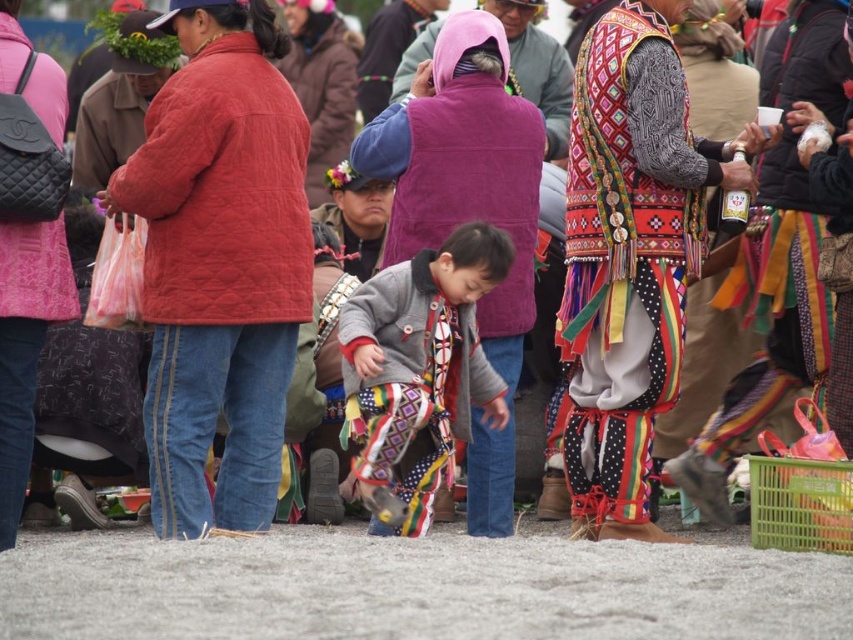
Question: Can you confirm if purple fleece vest at center is smaller than patterned fabric pants at center?

Choices:
 (A) yes
 (B) no

Answer: (B)

Question: Does quilted red jacket at center appear over purple fleece vest at center?

Choices:
 (A) no
 (B) yes

Answer: (A)

Question: Considering the real-world distances, which object is farthest from the purple fleece vest at center?

Choices:
 (A) patterned fabric pants at center
 (B) quilted red jacket at center
 (C) embroidered fabric dress at center

Answer: (A)

Question: Which point is closer to the camera?

Choices:
 (A) (422, 275)
 (B) (595, 138)

Answer: (A)

Question: Is quilted red jacket at center above purple fleece vest at center?

Choices:
 (A) no
 (B) yes

Answer: (A)

Question: Which of the following is the closest to the observer?

Choices:
 (A) embroidered fabric dress at center
 (B) patterned fabric pants at center
 (C) purple fleece vest at center
 (D) quilted red jacket at center

Answer: (D)